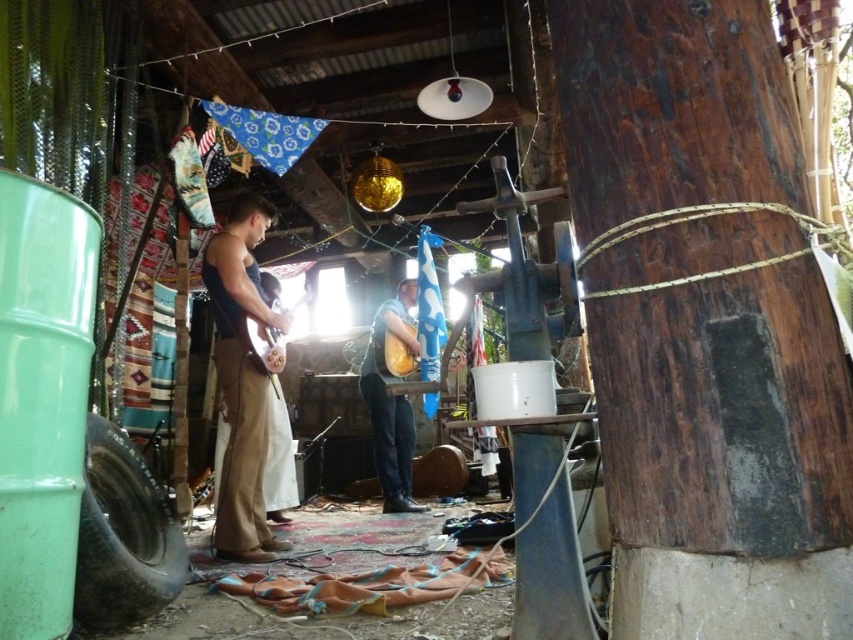
Question: Is brown suede guitar at center below matte brown guitar at center?

Choices:
 (A) no
 (B) yes

Answer: (A)

Question: Does brown suede guitar at center have a greater width compared to matte brown guitar at center?

Choices:
 (A) no
 (B) yes

Answer: (A)

Question: Among these objects, which one is farthest from the camera?

Choices:
 (A) brown suede guitar at center
 (B) matte brown guitar at center

Answer: (B)

Question: Which of the following is the closest to the observer?

Choices:
 (A) brown suede guitar at center
 (B) matte brown guitar at center

Answer: (A)

Question: Is brown suede guitar at center positioned in front of matte brown guitar at center?

Choices:
 (A) no
 (B) yes

Answer: (B)